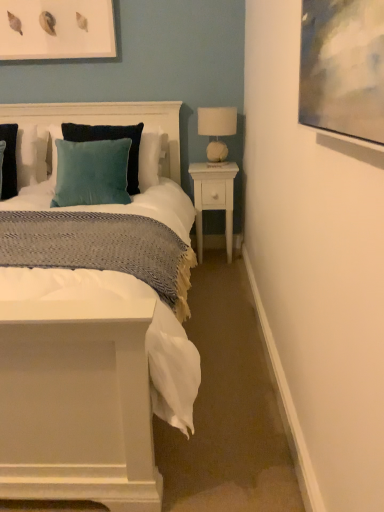
Question: Are velvet cushion at upper left and white wood nightstand at right located far from each other?

Choices:
 (A) yes
 (B) no

Answer: (B)

Question: Can you confirm if velvet cushion at upper left is shorter than white wood nightstand at right?

Choices:
 (A) no
 (B) yes

Answer: (B)

Question: Is velvet cushion at upper left aimed at white wood nightstand at right?

Choices:
 (A) no
 (B) yes

Answer: (A)

Question: Is velvet cushion at upper left at the right side of white wood nightstand at right?

Choices:
 (A) no
 (B) yes

Answer: (A)

Question: Is velvet cushion at upper left positioned with its back to white wood nightstand at right?

Choices:
 (A) yes
 (B) no

Answer: (B)

Question: From a real-world perspective, is velvet cushion at upper left under white wood nightstand at right?

Choices:
 (A) yes
 (B) no

Answer: (B)

Question: Is matte white picture frame at upper left shorter than white wood nightstand at right?

Choices:
 (A) no
 (B) yes

Answer: (B)

Question: Is matte white picture frame at upper left oriented towards white wood nightstand at right?

Choices:
 (A) yes
 (B) no

Answer: (B)

Question: From a real-world perspective, does matte white picture frame at upper left sit lower than white wood nightstand at right?

Choices:
 (A) no
 (B) yes

Answer: (A)

Question: Considering the relative sizes of matte white picture frame at upper left and white wood nightstand at right in the image provided, is matte white picture frame at upper left wider than white wood nightstand at right?

Choices:
 (A) yes
 (B) no

Answer: (B)

Question: From the image's perspective, is matte white picture frame at upper left on top of white wood nightstand at right?

Choices:
 (A) no
 (B) yes

Answer: (B)

Question: Is matte white picture frame at upper left to the left of white wood nightstand at right from the viewer's perspective?

Choices:
 (A) no
 (B) yes

Answer: (B)

Question: Considering the relative sizes of velvet teal pillow at center and velvet cushion at upper left in the image provided, is velvet teal pillow at center bigger than velvet cushion at upper left?

Choices:
 (A) no
 (B) yes

Answer: (A)